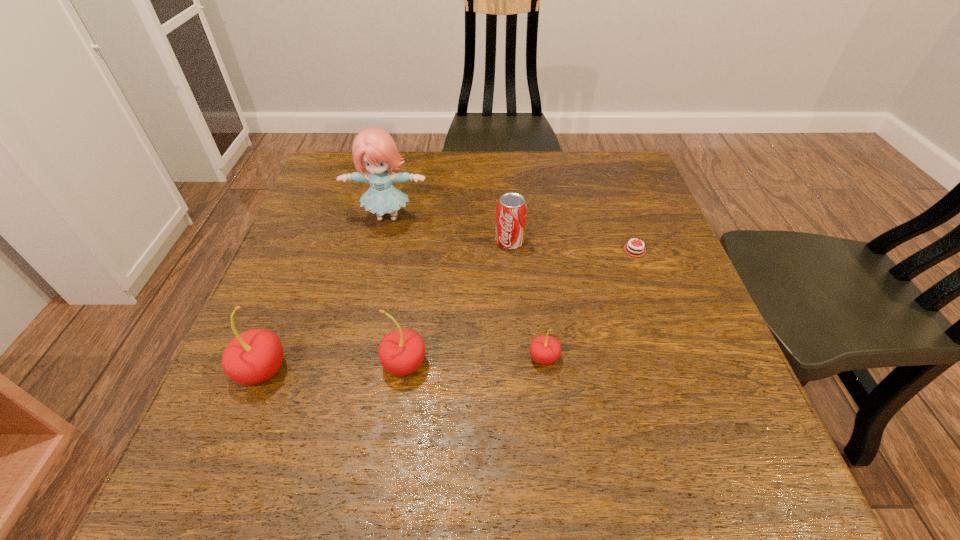
In order to click on free spot located 0.340m on the right of the leftmost object in this screenshot , I will do `click(479, 370)`.

The image size is (960, 540). What are the coordinates of `vacant space located on the right of the second cherry from right to left` in the screenshot? It's located at (455, 363).

Image resolution: width=960 pixels, height=540 pixels. Identify the location of free region located on the back of the shortest cherry. (531, 248).

Identify the location of vacant region located on the front-facing side of the tallest object. (362, 329).

Where is `vacant space positioned on the left of the chocolate cake`? vacant space positioned on the left of the chocolate cake is located at coordinates (474, 250).

Locate an element on the screen. This screenshot has height=540, width=960. vacant region located 0.360m on the left of the third shortest object is located at coordinates (341, 242).

At what (x,y) coordinates should I click in order to perform the action: click on cherry present at the left edge. Please return your answer as a coordinate pair (x, y). Looking at the image, I should click on tap(252, 357).

The width and height of the screenshot is (960, 540). I want to click on doll positioned at the left edge, so click(374, 149).

Locate an element on the screen. This screenshot has height=540, width=960. object located at the right edge is located at coordinates (640, 251).

You are a GUI agent. You are given a task and a screenshot of the screen. Output one action in this format:
    pyautogui.click(x=<x>, y=<y>)
    Task: Click on the object present at the near left corner
    The image size is (960, 540).
    Given the screenshot: What is the action you would take?
    pyautogui.click(x=252, y=357)